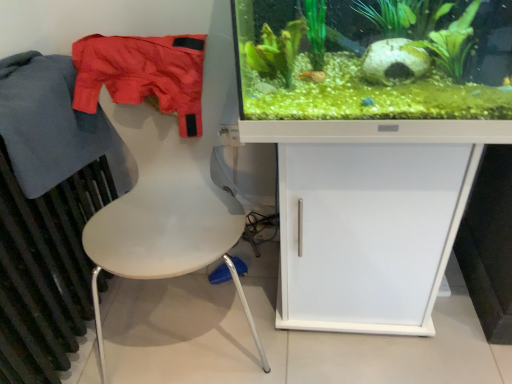
Locate an element on the screen. This screenshot has width=512, height=384. dark gray metallic radiator at left is located at coordinates (45, 271).

Identify the location of blue cotton jacket at left, the 1th clothing positioned from the left. (54, 126).

Image resolution: width=512 pixels, height=384 pixels. What do you see at coordinates (370, 217) in the screenshot?
I see `white matte cabinet at center` at bounding box center [370, 217].

This screenshot has height=384, width=512. Identify the location of dark gray metallic radiator at left. (45, 271).

Considering the relative positions of green matte plant at upper center and white matte cabinet at center in the image provided, is green matte plant at upper center to the left or to the right of white matte cabinet at center?

Based on their positions, green matte plant at upper center is located to the left of white matte cabinet at center.

In terms of size, does green matte plant at upper center appear bigger or smaller than white matte cabinet at center?

Considering their sizes, green matte plant at upper center takes up less space than white matte cabinet at center.

Which object is closer to the camera taking this photo, green matte plant at upper center or white matte cabinet at center?

green matte plant at upper center.

In the image, is dark gray metallic radiator at left on the left side or the right side of white matte cabinet at center?

Clearly, dark gray metallic radiator at left is on the left of white matte cabinet at center in the image.

Could white matte cabinet at center be considered to be inside dark gray metallic radiator at left?

That's incorrect, white matte cabinet at center is not inside dark gray metallic radiator at left.

Is dark gray metallic radiator at left positioned with its back to white matte cabinet at center?

No, dark gray metallic radiator at left is not facing away from white matte cabinet at center.

Does point (70, 340) appear closer or farther from the camera than point (295, 256)?

Point (70, 340) appears to be farther away from the viewer than point (295, 256).

Is white matte cabinet at center at the left side of blue cotton jacket at left, which appears as the 2th clothing when viewed from the right?

No.

Could you tell me if white matte cabinet at center is facing blue cotton jacket at left, the 1th clothing positioned from the left?

No.

From the image's perspective, is white matte cabinet at center above blue cotton jacket at left, the 1th clothing positioned from the left?

No.

Is dark gray metallic radiator at left aimed at green matte plant at upper center?

Yes.

Which object is closer to the camera taking this photo, dark gray metallic radiator at left or green matte plant at upper center?

dark gray metallic radiator at left is closer to the camera.

From the picture: From a real-world perspective, is dark gray metallic radiator at left under green matte plant at upper center?

Yes, from a real-world perspective, dark gray metallic radiator at left is below green matte plant at upper center.

In the scene shown: Are blue cotton jacket at left, the 1th clothing positioned from the left, and dark gray metallic radiator at left far apart?

No, blue cotton jacket at left, the 1th clothing positioned from the left, is in close proximity to dark gray metallic radiator at left.

Can you confirm if blue cotton jacket at left, which appears as the 2th clothing when viewed from the right, is shorter than dark gray metallic radiator at left?

Yes.

Considering their positions, is blue cotton jacket at left, which appears as the 2th clothing when viewed from the right, located in front of or behind dark gray metallic radiator at left?

Clearly, blue cotton jacket at left, which appears as the 2th clothing when viewed from the right, is behind dark gray metallic radiator at left.

Can you see white matte cabinet at center touching matte nylon shorts at left, the 1th clothing positioned from the right?

white matte cabinet at center and matte nylon shorts at left, the 1th clothing positioned from the right, are clearly separated.

Who is smaller, white matte cabinet at center or matte nylon shorts at left, the 1th clothing positioned from the right?

matte nylon shorts at left, the 1th clothing positioned from the right.

Which of these two, white matte cabinet at center or matte nylon shorts at left, the 1th clothing positioned from the right, is wider?

white matte cabinet at center.

From a real-world perspective, is white matte cabinet at center under matte nylon shorts at left, the 1th clothing positioned from the right?

Yes.

Is point (192, 184) positioned in front of point (70, 333)?

Yes, point (192, 184) is closer to viewer.

Where is `chair on the right of dark gray metallic radiator at left`? chair on the right of dark gray metallic radiator at left is located at coordinates (169, 216).

Considering the relative sizes of white matte chair at left and dark gray metallic radiator at left in the image provided, is white matte chair at left bigger than dark gray metallic radiator at left?

Correct, white matte chair at left is larger in size than dark gray metallic radiator at left.

Where is `computer desk on the right of the green matte plant at upper center`? The height and width of the screenshot is (384, 512). computer desk on the right of the green matte plant at upper center is located at coordinates (370, 217).

The height and width of the screenshot is (384, 512). Identify the location of radiator above the white matte cabinet at center (from a real-world perspective). (45, 271).

Based on their spatial positions, is blue cotton jacket at left, which appears as the 2th clothing when viewed from the right, or white matte chair at left further from white matte cabinet at center?

The object further to white matte cabinet at center is blue cotton jacket at left, which appears as the 2th clothing when viewed from the right.

Based on the photo, based on their spatial positions, is green matte plant at upper center or white matte chair at left closer to dark gray metallic radiator at left?

white matte chair at left is closer to dark gray metallic radiator at left.

In the scene shown: Looking at the image, which one is located closer to white matte chair at left, white matte cabinet at center or matte nylon shorts at left, placed as the second clothing when sorted from left to right?

matte nylon shorts at left, placed as the second clothing when sorted from left to right.

Considering their positions, is white matte cabinet at center positioned closer to green matte plant at upper center than blue cotton jacket at left, the 1th clothing positioned from the left?

The object closer to green matte plant at upper center is white matte cabinet at center.

Estimate the real-world distances between objects in this image. Which object is closer to white matte cabinet at center, white matte chair at left or green matte plant at upper center?

white matte chair at left lies closer to white matte cabinet at center than the other object.

When comparing their distances from white matte chair at left, does matte nylon shorts at left, the 1th clothing positioned from the right, or blue cotton jacket at left, which appears as the 2th clothing when viewed from the right, seem closer?

matte nylon shorts at left, the 1th clothing positioned from the right, is positioned closer to the anchor white matte chair at left.

From the image, which object appears to be farther from blue cotton jacket at left, the 1th clothing positioned from the left, matte nylon shorts at left, the 1th clothing positioned from the right, or white matte chair at left?

white matte chair at left is positioned further to the anchor blue cotton jacket at left, the 1th clothing positioned from the left.

When comparing their distances from white matte chair at left, does dark gray metallic radiator at left or matte nylon shorts at left, placed as the second clothing when sorted from left to right, seem further?

dark gray metallic radiator at left.

I want to click on plant located between blue cotton jacket at left, which appears as the 2th clothing when viewed from the right, and white matte cabinet at center in the left-right direction, so click(x=375, y=60).

Image resolution: width=512 pixels, height=384 pixels. In order to click on clothing that lies between matte nylon shorts at left, placed as the second clothing when sorted from left to right, and dark gray metallic radiator at left from top to bottom in this screenshot , I will do `click(54, 126)`.

The image size is (512, 384). Identify the location of radiator between blue cotton jacket at left, which appears as the 2th clothing when viewed from the right, and green matte plant at upper center, in the horizontal direction. (45, 271).

Where is `chair between matte nylon shorts at left, the 1th clothing positioned from the right, and dark gray metallic radiator at left from top to bottom`? Image resolution: width=512 pixels, height=384 pixels. chair between matte nylon shorts at left, the 1th clothing positioned from the right, and dark gray metallic radiator at left from top to bottom is located at coordinates (169, 216).